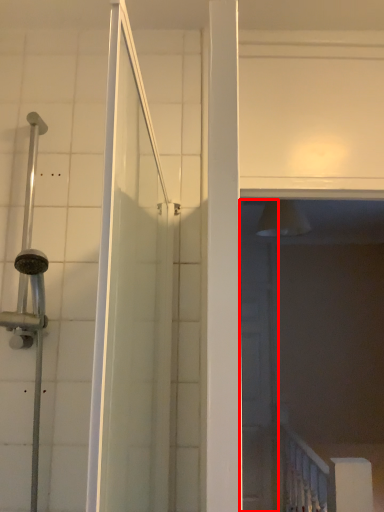
Question: From the image's perspective, what is the correct spatial relationship of screen door (annotated by the red box) in relation to rail?

Choices:
 (A) below
 (B) above

Answer: (B)